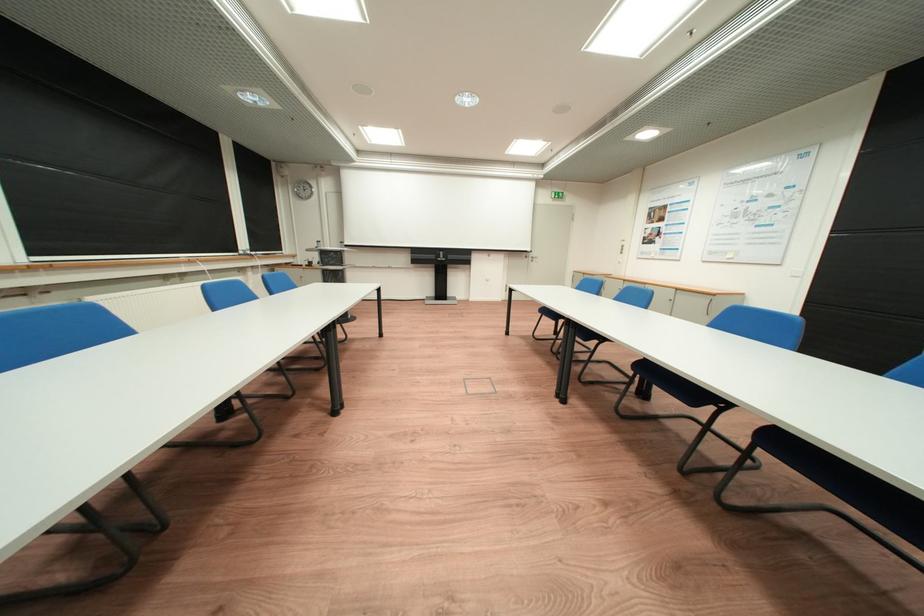
What do you see at coordinates (532, 257) in the screenshot? I see `the door handle` at bounding box center [532, 257].